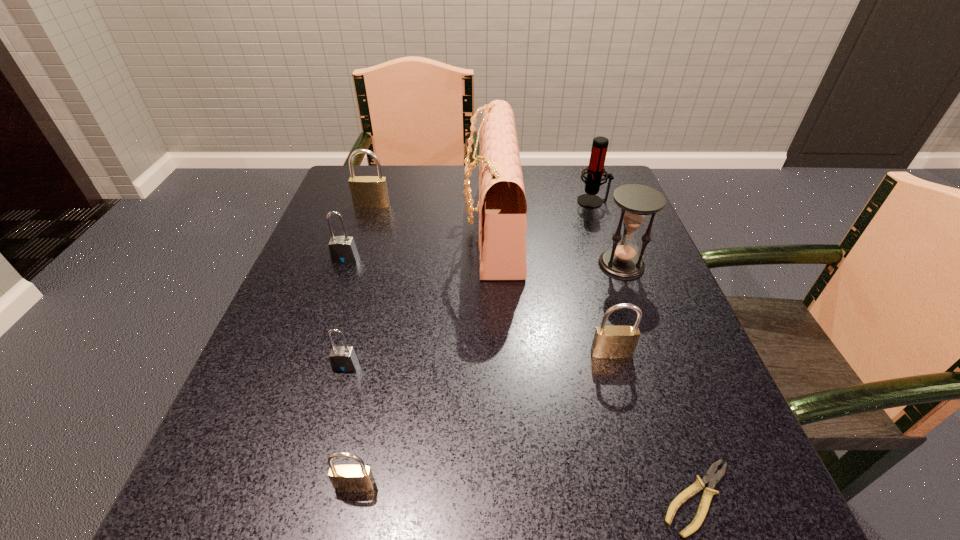
In order to click on pliers that is at the near edge in this screenshot , I will do `click(712, 479)`.

Locate an element on the screen. The image size is (960, 540). microphone at the right edge is located at coordinates (595, 170).

The height and width of the screenshot is (540, 960). What are the coordinates of `hourglass that is at the right edge` in the screenshot? It's located at (637, 202).

You are a GUI agent. You are given a task and a screenshot of the screen. Output one action in this format:
    pyautogui.click(x=<x>, y=<y>)
    Task: Click on the padlock that is at the right edge
    The image size is (960, 540).
    Given the screenshot: What is the action you would take?
    pyautogui.click(x=609, y=341)

Image resolution: width=960 pixels, height=540 pixels. In order to click on pliers located at the right edge in this screenshot , I will do `click(712, 479)`.

At what (x,y) coordinates should I click in order to perform the action: click on object that is at the far left corner. Please return your answer as a coordinate pair (x, y). Looking at the image, I should click on (367, 191).

I want to click on object situated at the far right corner, so click(595, 170).

The image size is (960, 540). Identify the location of object that is at the near right corner. (712, 479).

This screenshot has height=540, width=960. What are the coordinates of `free space at the far edge` in the screenshot? It's located at (548, 181).

The height and width of the screenshot is (540, 960). What are the coordinates of `vacant region at the near edge of the desktop` in the screenshot? It's located at (523, 481).